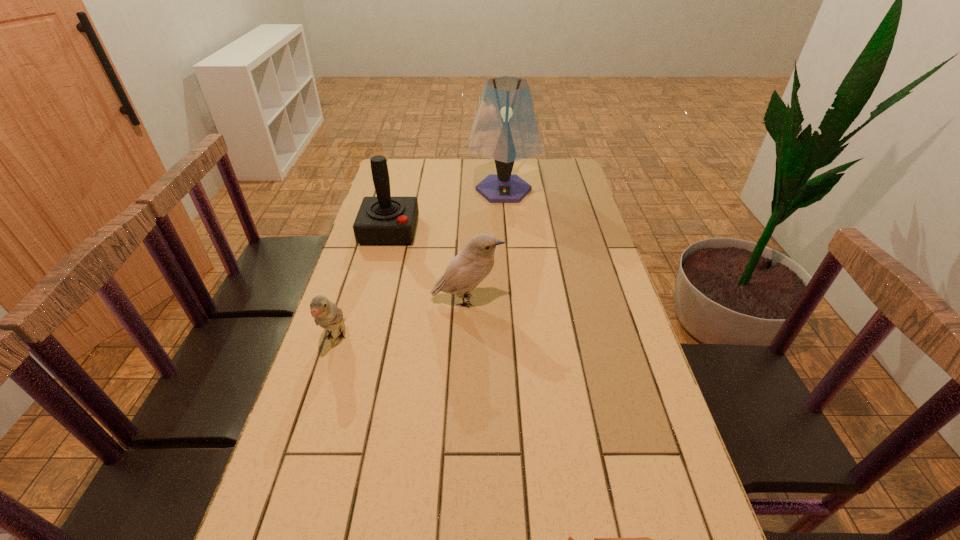
Where is `the tallest object`? the tallest object is located at coordinates (505, 129).

I want to click on lampshade, so click(505, 129).

What are the coordinates of `the second farthest object` in the screenshot? It's located at (383, 220).

The height and width of the screenshot is (540, 960). Identify the location of the third shortest object. click(x=471, y=266).

I want to click on the second bird from left to right, so click(471, 266).

This screenshot has height=540, width=960. Identify the location of the leftmost bird. (326, 314).

Locate an element on the screen. the second tallest bird is located at coordinates (326, 314).

Locate an element on the screen. The width and height of the screenshot is (960, 540). free space located on the base of the farthest object is located at coordinates (507, 235).

I want to click on vacant region located on the base of the joystick, so click(x=363, y=330).

Locate an element on the screen. The image size is (960, 540). vacant space located 0.350m at the beak of the third tallest object is located at coordinates (624, 300).